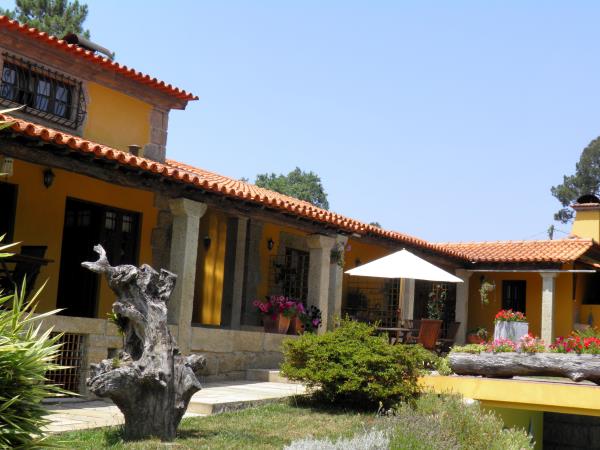
Locate an element on the screen. beams is located at coordinates (551, 292), (460, 301), (337, 291), (321, 291), (188, 265).